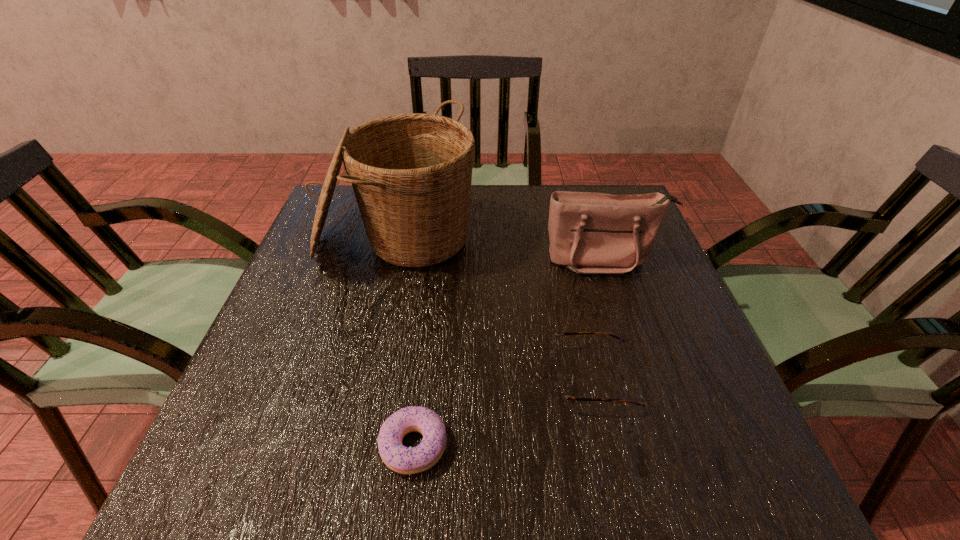
The width and height of the screenshot is (960, 540). In order to click on object that can be found as the closest to the spectacles in this screenshot , I will do `click(401, 459)`.

Locate an element on the screen. object that can be found as the second closest to the doughnut is located at coordinates [411, 173].